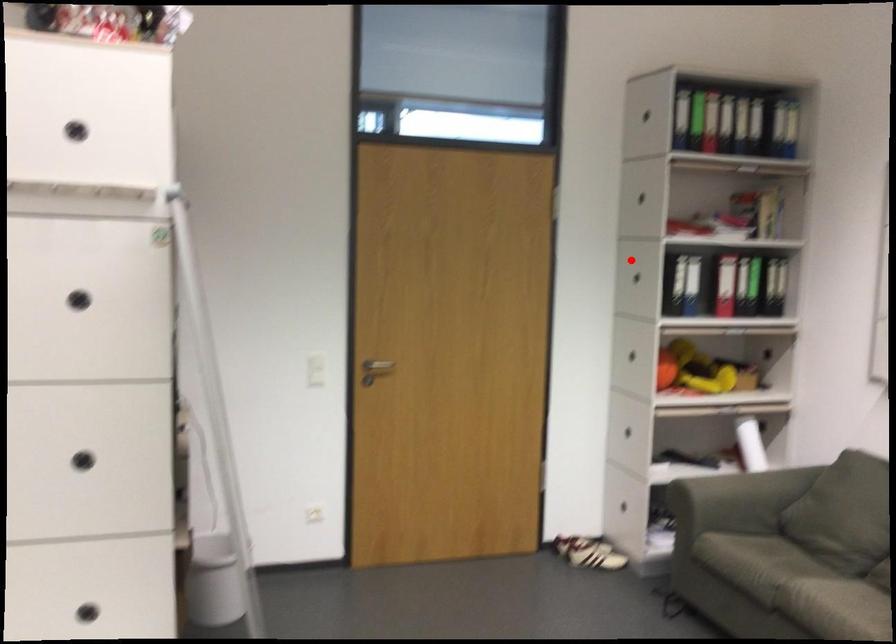
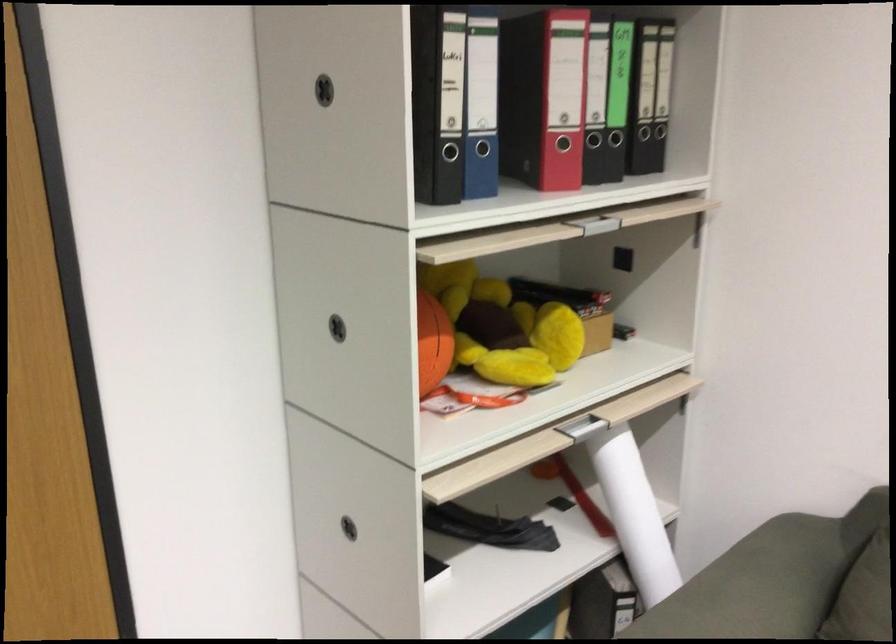
Where in the second image is the point corresponding to the highlighted location from the first image?

(326, 86)